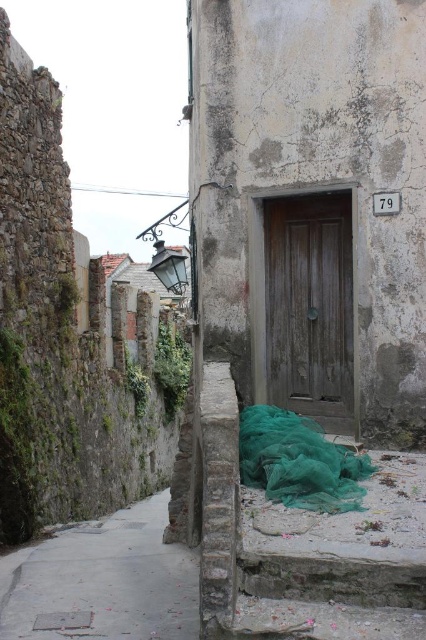
Does wooden door at center have a greater width compared to green mesh netting at lower center?

In fact, wooden door at center might be narrower than green mesh netting at lower center.

Does wooden door at center lie behind green mesh netting at lower center?

Yes.

Where is `wooden door at center`? wooden door at center is located at coordinates click(x=310, y=307).

At what (x,y) coordinates should I click in order to perform the action: click on wooden door at center. Please return your answer as a coordinate pair (x, y). Looking at the image, I should click on (310, 307).

Which is above, concrete sidewalk at lower left or green mesh netting at lower center?

green mesh netting at lower center is higher up.

I want to click on concrete sidewalk at lower left, so click(x=103, y=580).

This screenshot has width=426, height=640. What are the coordinates of `concrete sidewalk at lower left` in the screenshot? It's located at (103, 580).

In order to click on concrete sidewalk at lower left in this screenshot , I will do `click(103, 580)`.

Is concrete sidewalk at lower left taller than wooden door at center?

No, concrete sidewalk at lower left is not taller than wooden door at center.

The width and height of the screenshot is (426, 640). What are the coordinates of `concrete sidewalk at lower left` in the screenshot? It's located at (103, 580).

At what (x,y) coordinates should I click in order to perform the action: click on concrete sidewalk at lower left. Please return your answer as a coordinate pair (x, y). The image size is (426, 640). Looking at the image, I should click on (103, 580).